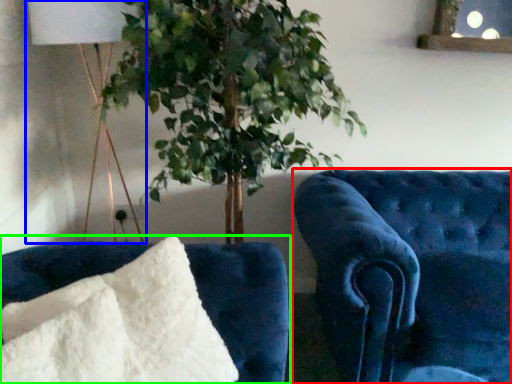
Question: Considering the real-world distances, which object is closest to furniture (highlighted by a red box)? table lamp (highlighted by a blue box) or furniture (highlighted by a green box).

Choices:
 (A) table lamp
 (B) furniture

Answer: (B)